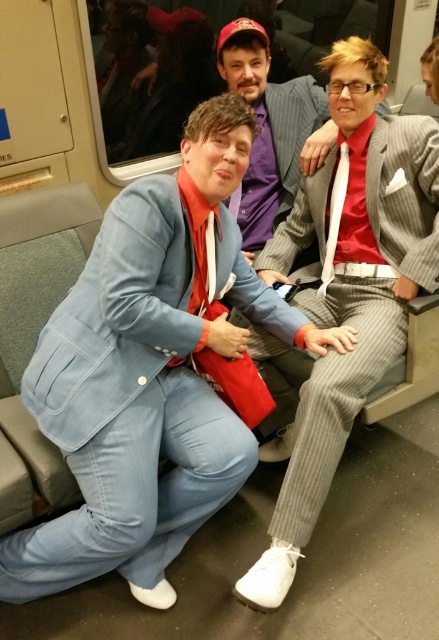
Who is taller, light blue denim suit at center or striped suit at center?

light blue denim suit at center

How far apart are light blue denim suit at center and striped suit at center?

The distance of light blue denim suit at center from striped suit at center is 30.01 inches.

This screenshot has height=640, width=439. Identify the location of light blue denim suit at center. [x=151, y=372].

This screenshot has height=640, width=439. In order to click on light blue denim suit at center in this screenshot , I will do `click(151, 372)`.

Between point (179, 376) and point (399, 275), which one is positioned behind?

Point (399, 275)

In the scene shown: Between light blue denim suit at center and gray pinstripe suit at right, which one appears on the left side from the viewer's perspective?

light blue denim suit at center

Identify the location of light blue denim suit at center. (151, 372).

The width and height of the screenshot is (439, 640). Describe the element at coordinates (349, 284) in the screenshot. I see `gray pinstripe suit at right` at that location.

Which of these two, gray pinstripe suit at right or striped suit at center, stands taller?

Standing taller between the two is gray pinstripe suit at right.

Describe the element at coordinates (349, 284) in the screenshot. I see `gray pinstripe suit at right` at that location.

Image resolution: width=439 pixels, height=640 pixels. What are the coordinates of `gray pinstripe suit at right` in the screenshot? It's located at (349, 284).